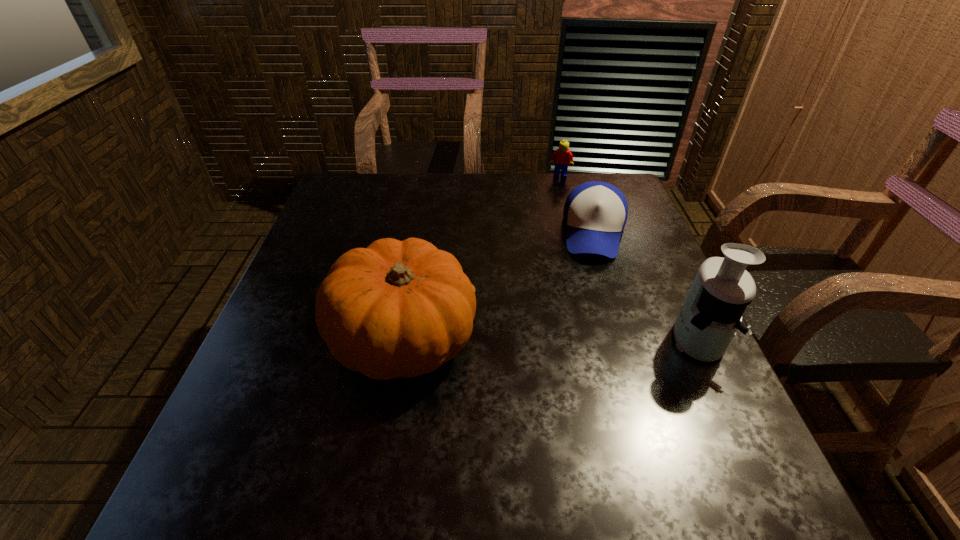
In the image, there is a desktop. Where is `free space at the near right corner`? free space at the near right corner is located at coordinates (726, 441).

Locate an element on the screen. This screenshot has width=960, height=540. vacant area that lies between the baseball cap and the juicer is located at coordinates (645, 285).

The image size is (960, 540). I want to click on free space between the farthest object and the second tallest object, so (482, 257).

Locate an element on the screen. The width and height of the screenshot is (960, 540). free spot between the Lego and the tallest object is located at coordinates (628, 257).

Where is `free space between the leftmost object and the juicer`? free space between the leftmost object and the juicer is located at coordinates (549, 339).

Find the location of a particular element. vacant point located between the farthest object and the pumpkin is located at coordinates (482, 257).

Locate an element on the screen. Image resolution: width=960 pixels, height=540 pixels. free space between the pumpkin and the farthest object is located at coordinates 482,257.

In order to click on free space between the farthest object and the second tallest object in this screenshot , I will do (482, 257).

Image resolution: width=960 pixels, height=540 pixels. In order to click on vacant area that lies between the pumpkin and the second farthest object in this screenshot , I will do pos(499,285).

At what (x,y) coordinates should I click in order to perform the action: click on empty space that is in between the baseball cap and the leftmost object. Please return your answer as a coordinate pair (x, y). Looking at the image, I should click on (499, 285).